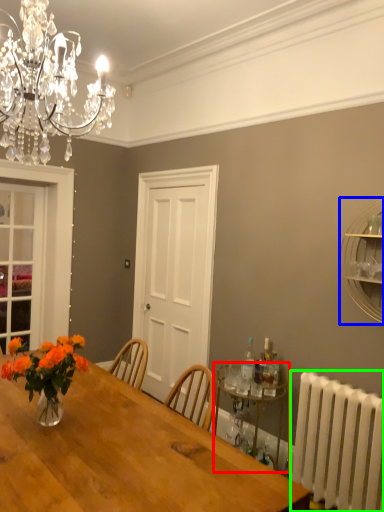
Question: Based on their relative distances, which object is nearer to shelf (highlighted by a red box)? Choose from shelf (highlighted by a blue box) and radiator (highlighted by a green box).

Choices:
 (A) shelf
 (B) radiator

Answer: (B)